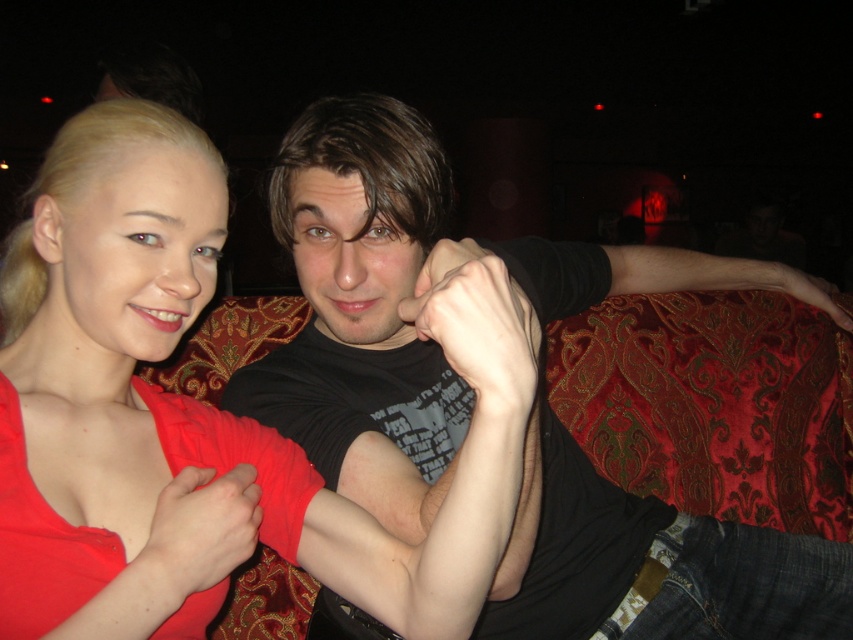
You are a photographer adjusting lighting for a portrait. You need to ensure the matte red dress at center and the black matte shirt at center are both visible. Since the dress is above the shirt, where should you position your main light to evenly illuminate both?

Position the main light directly in front and slightly below the matte red dress at center to illuminate both it and the black matte shirt at center evenly, as the dress is above the shirt.

You are taking a photo of two people sitting on a red patterned couch in a dimly lit bar. You want to focus on the person closer to the camera. Which point, point (358, 563) or point (370, 328), should you aim your camera at?

Point (358, 563) is closer to the camera than point (370, 328), so you should aim your camera at point (358, 563) to focus on the person closer to the camera.

You are a photographer setting up a shoot in this scene. You need to place a backdrop that is 1.2 meters wide. The backdrop must be positioned between the matte red dress at center and the black matte shirt at center. Considering their widths, which object should the backdrop be placed closer to to ensure it fits without overlapping?

The matte red dress at center has a lesser width compared to black matte shirt at center. Therefore, the backdrop should be placed closer to the matte red dress at center to accommodate the wider black matte shirt at center and prevent overlapping.